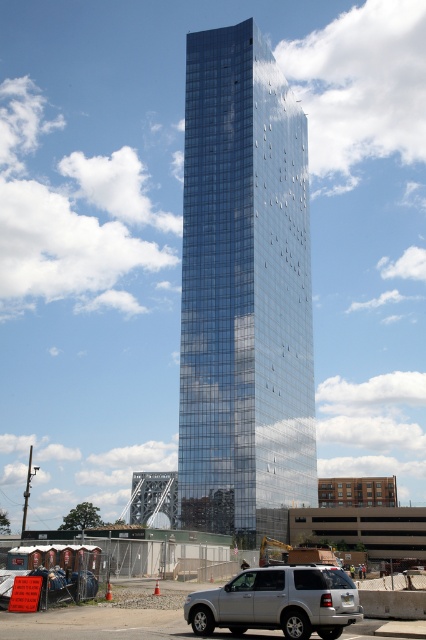
You are standing at the base of the skyscraper and want to take a photo of the point at coordinates point (x=270, y=422). If your camera can focus up to 100 meters, will it be able to capture that point clearly?

The distance of point (x=270, y=422) from the camera is 106.26 meters, which exceeds the camera focus limit of 100 meters. Therefore, the camera cannot capture the point clearly.

You are a photographer standing in front of the glossy glass tower at center and the silver metallic suv at lower center. You want to capture a photo where both objects are visible. Since the sky is bright, you need to adjust your camera settings to avoid overexposure. Which object should you prioritize focusing on to ensure proper exposure?

The glossy glass tower at center is taller than the silver metallic suv at lower center. Since the tower is taller and occupies more of the frame vertically, focusing on it would help balance the exposure, especially considering its reflective surface under the bright sky.

You are standing in front of the skyscraper and want to take a photo of the glossy glass tower at center without the silver metallic suv at lower center blocking the view. Is the suv positioned in a way that it might block the lower part of the tower in your photo?

The glossy glass tower at center is above the silver metallic suv at lower center, so the suv is only blocking the lower part of the tower. To capture the entire tower without obstruction, you would need to position yourself higher or move the suv.